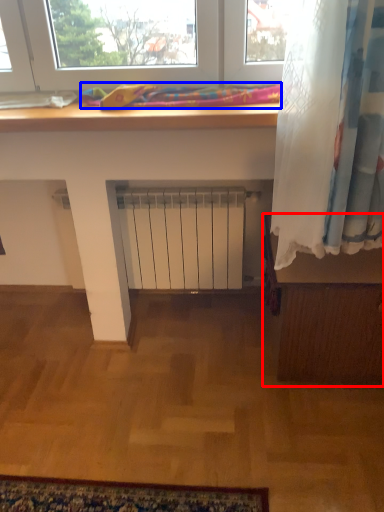
Question: Which of the following is the closest to the observer, furniture (highlighted by a red box) or bedding (highlighted by a blue box)?

Choices:
 (A) furniture
 (B) bedding

Answer: (B)